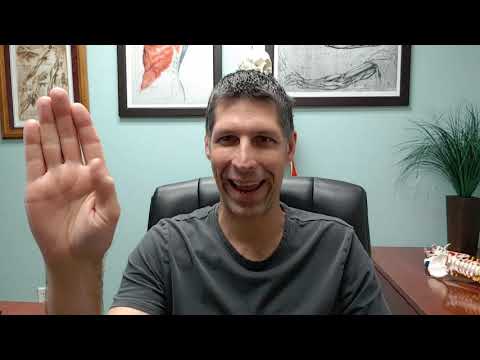
Find the location of a particular element. Image resolution: width=480 pixels, height=360 pixels. chair is located at coordinates (343, 204).